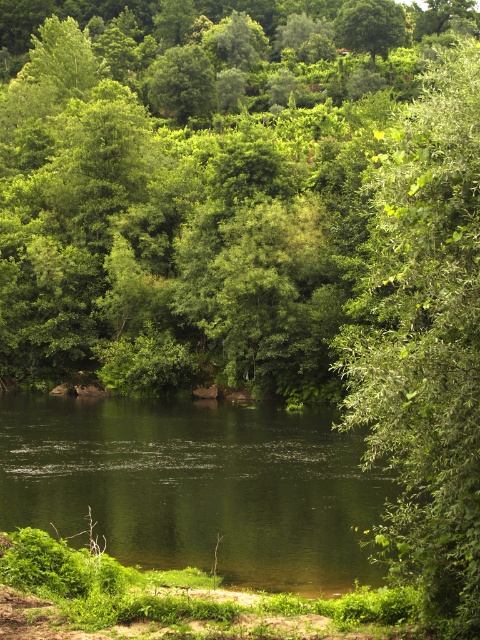
Locate an element on the screen. The height and width of the screenshot is (640, 480). green leafy tree at center is located at coordinates (228, 189).

Does point (301, 208) come in front of point (296, 445)?

No, it is behind (296, 445).

Where is `green leafy tree at center`? green leafy tree at center is located at coordinates (228, 189).

Locate an element on the screen. This screenshot has height=640, width=480. green smooth water at center is located at coordinates (196, 484).

From the picture: Between green smooth water at center and green leafy tree at right, which one is positioned higher?

green leafy tree at right

Describe the element at coordinates (196, 484) in the screenshot. This screenshot has height=640, width=480. I see `green smooth water at center` at that location.

At what (x,y) coordinates should I click in order to perform the action: click on green smooth water at center. Please return your answer as a coordinate pair (x, y). This screenshot has height=640, width=480. Looking at the image, I should click on (196, 484).

Does green leafy tree at right come behind green leafy tree at upper center?

No.

Between point (444, 458) and point (385, 22), which one is positioned behind?

Point (385, 22)

Is point (463, 184) farther from camera compared to point (369, 20)?

No, it is in front of (369, 20).

In order to click on green leafy tree at right in this screenshot , I will do `click(424, 339)`.